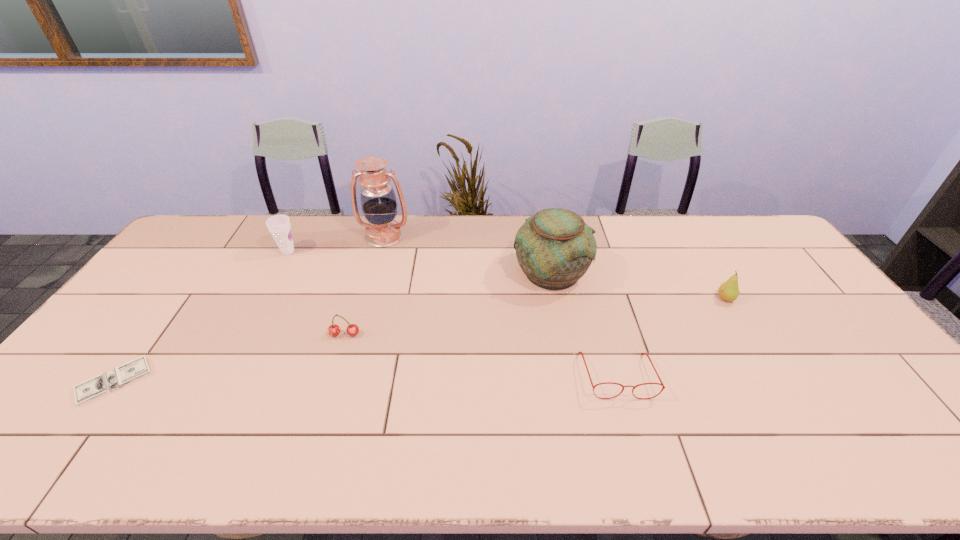
Where is `vacant space in between the dollar and the tallest object`? vacant space in between the dollar and the tallest object is located at coordinates (250, 309).

At what (x,y) coordinates should I click in order to perform the action: click on vacant space in between the pottery and the second shortest object. Please return your answer as a coordinate pair (x, y). The width and height of the screenshot is (960, 540). Looking at the image, I should click on (585, 324).

Image resolution: width=960 pixels, height=540 pixels. Identify the location of unoccupied position between the cup and the sixth shortest object. (420, 262).

The height and width of the screenshot is (540, 960). What are the coordinates of `unoccupied area between the cup and the pear` in the screenshot? It's located at (507, 275).

Identify the location of vacant point located between the tallest object and the cup. The width and height of the screenshot is (960, 540). (336, 244).

I want to click on unoccupied area between the sixth tallest object and the leftmost object, so click(366, 379).

At what (x,y) coordinates should I click in order to perform the action: click on object identified as the fourth closest to the cup. Please return your answer as a coordinate pair (x, y). Looking at the image, I should click on point(554,248).

Locate an element on the screen. object that is the nearest to the pottery is located at coordinates (581, 353).

At what (x,y) coordinates should I click in order to perform the action: click on free location that satisfies the following two spatial constraints: 1. on the back side of the shortest object; 2. on the left side of the tallest object. Please return your answer as a coordinate pair (x, y). The height and width of the screenshot is (540, 960). Looking at the image, I should click on (223, 237).